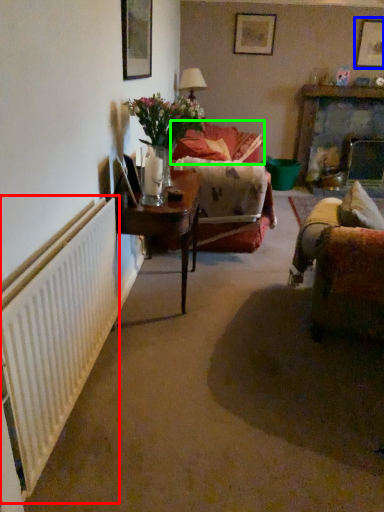
Question: Which object is the closest to the radiator (highlighted by a red box)? Choose among these: picture frame (highlighted by a blue box) or couch (highlighted by a green box).

Choices:
 (A) picture frame
 (B) couch

Answer: (B)